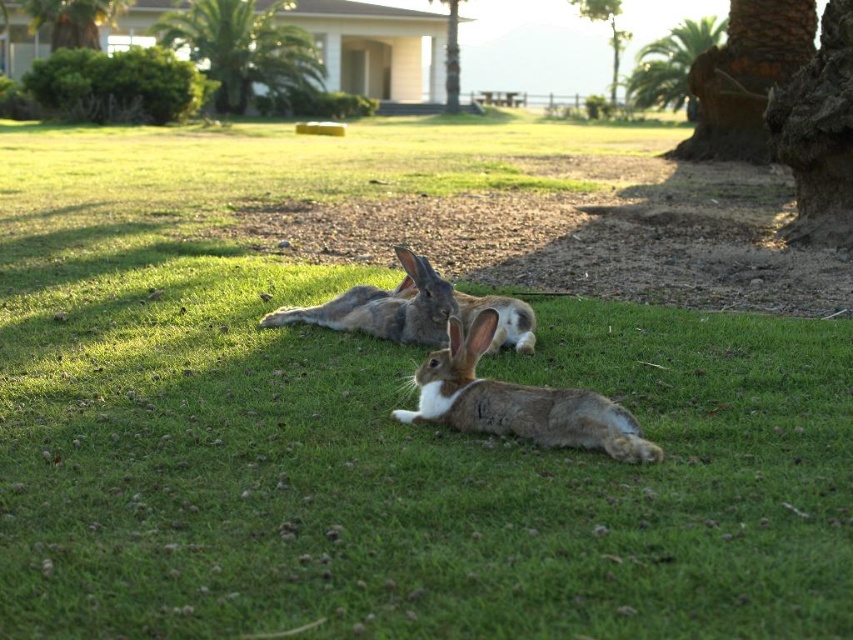
Which is below, fuzzy brown rabbit at center or green leafy palm tree at upper right?

fuzzy brown rabbit at center is below.

Who is positioned more to the left, fuzzy brown rabbit at center or green leafy palm tree at upper right?

fuzzy brown rabbit at center is more to the left.

At what (x,y) coordinates should I click in order to perform the action: click on fuzzy brown rabbit at center. Please return your answer as a coordinate pair (x, y). The width and height of the screenshot is (853, 640). Looking at the image, I should click on (415, 310).

This screenshot has height=640, width=853. Identify the location of fuzzy brown rabbit at center. (415, 310).

Which of these two, green leafy palm tree at upper center or green leafy palm tree at upper left, stands taller?

green leafy palm tree at upper center is taller.

Which of these two, green leafy palm tree at upper center or green leafy palm tree at upper left, stands shorter?

green leafy palm tree at upper left is shorter.

Between point (234, 54) and point (57, 33), which one is positioned behind?

Point (234, 54)

You are a GUI agent. You are given a task and a screenshot of the screen. Output one action in this format:
    pyautogui.click(x=<x>, y=<y>)
    Task: Click on the green leafy palm tree at upper center
    This screenshot has width=853, height=640.
    Given the screenshot: What is the action you would take?
    pyautogui.click(x=242, y=49)

Can you confirm if brown furry rabbit at center is positioned to the right of green leafy palm tree at upper left?

Correct, you'll find brown furry rabbit at center to the right of green leafy palm tree at upper left.

The width and height of the screenshot is (853, 640). Describe the element at coordinates (517, 401) in the screenshot. I see `brown furry rabbit at center` at that location.

Locate an element on the screen. brown furry rabbit at center is located at coordinates (517, 401).

I want to click on brown furry rabbit at center, so click(517, 401).